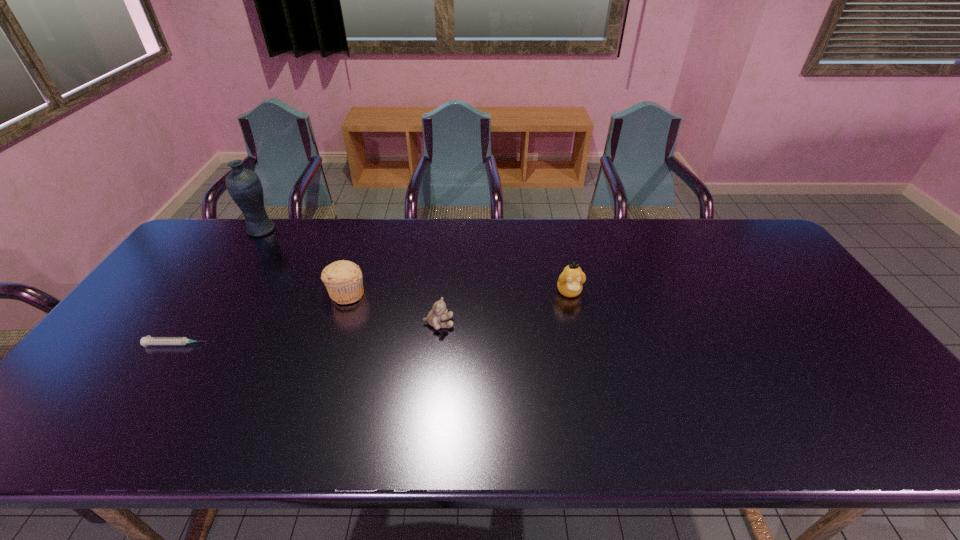
This screenshot has height=540, width=960. I want to click on vacant area between the muffin and the farthest object, so click(x=304, y=262).

The width and height of the screenshot is (960, 540). What are the coordinates of `object that is the third nearest to the farthest object` in the screenshot? It's located at (439, 312).

Find the location of a particular element. The image size is (960, 540). object that is the second closest one to the second shortest object is located at coordinates (570, 281).

This screenshot has height=540, width=960. What are the coordinates of `free space in the image that satisfies the following two spatial constraints: 1. on the front side of the farthest object; 2. at the needle end of the nearest object` in the screenshot? It's located at (186, 345).

This screenshot has width=960, height=540. Identify the location of vacant region that satisfies the following two spatial constraints: 1. on the front side of the third object from left to right; 2. on the right side of the tallest object. (220, 294).

The width and height of the screenshot is (960, 540). What are the coordinates of `vacant area in the image that satisfies the following two spatial constraints: 1. on the face of the duckling; 2. on the face of the second nearest object` in the screenshot? It's located at pyautogui.click(x=576, y=323).

What are the coordinates of `vacant region that satisfies the following two spatial constraints: 1. on the face of the duckling; 2. at the needle end of the nearest object` in the screenshot? It's located at (581, 345).